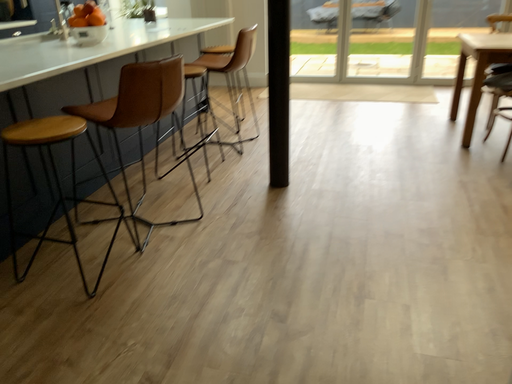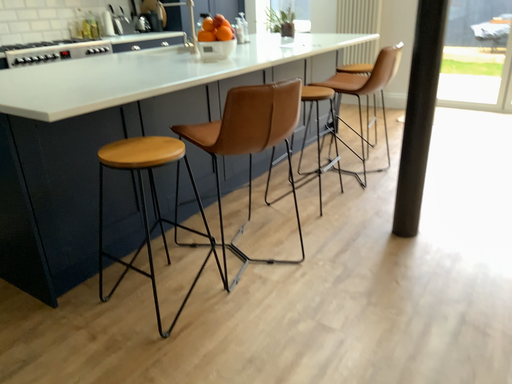
Question: How did the camera likely rotate when shooting the video?

Choices:
 (A) rotated right
 (B) rotated left

Answer: (B)